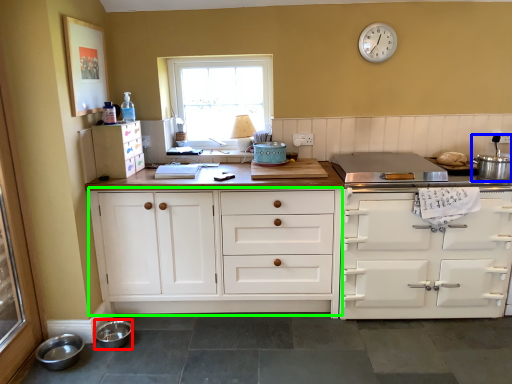
Question: Which is farther away from bowl (highlighted by a red box)? appliance (highlighted by a blue box) or cabinetry (highlighted by a green box)?

Choices:
 (A) appliance
 (B) cabinetry

Answer: (A)